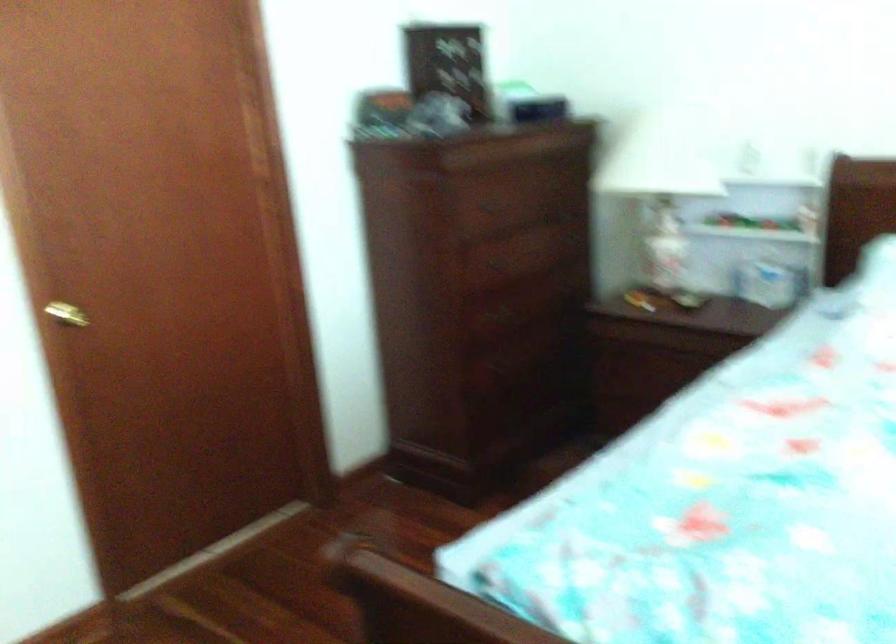
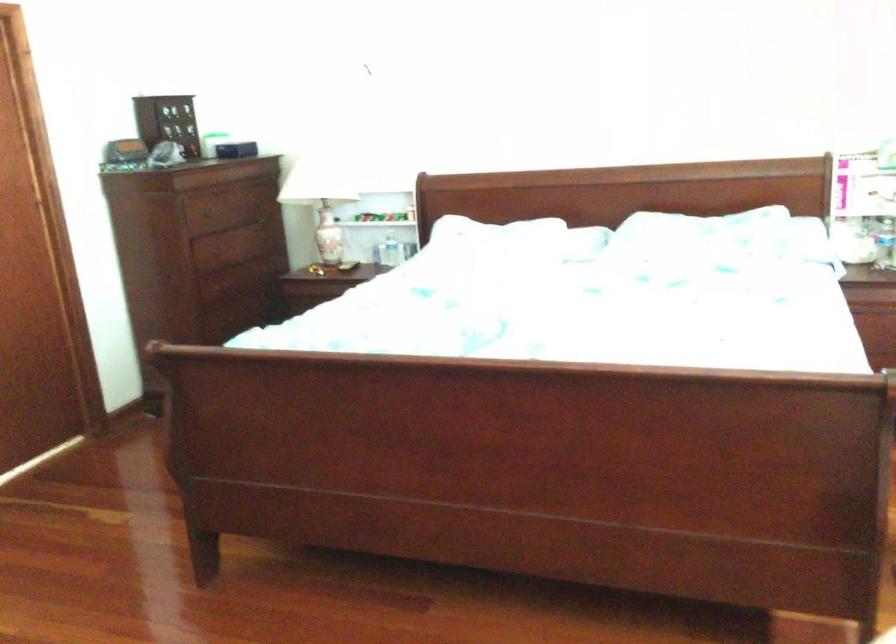
Question: In a continuous first-person perspective shot, in which direction is the camera moving?

Choices:
 (A) Left
 (B) Right
 (C) Forward
 (D) Backward

Answer: (D)